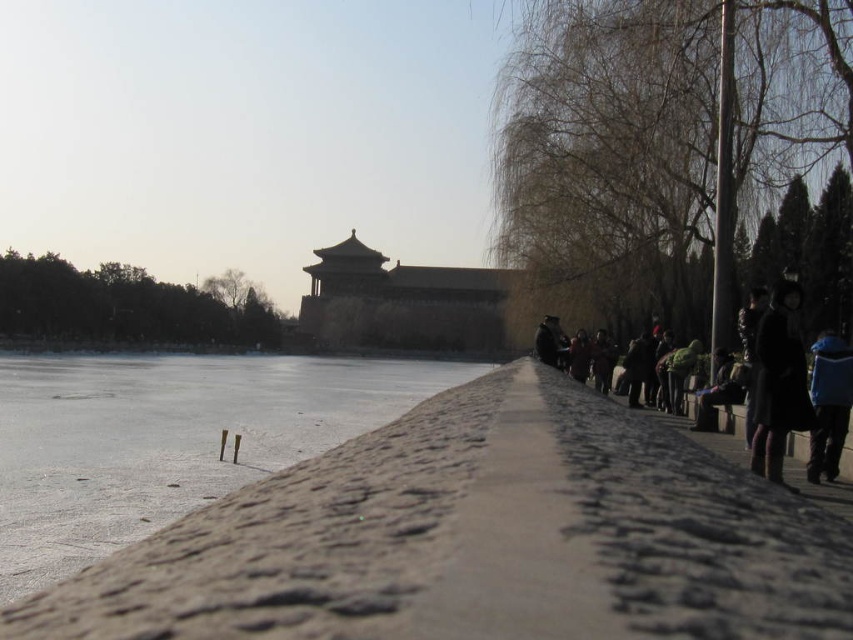
Question: Is frozen ice at lower left to the right of blue fabric jacket at right from the viewer's perspective?

Choices:
 (A) no
 (B) yes

Answer: (A)

Question: Which object appears closest to the camera in this image?

Choices:
 (A) blue fabric jacket at right
 (B) dark blue coat at right
 (C) dark wool coat at right
 (D) frozen ice at lower left

Answer: (B)

Question: Which is farther from the dark blue coat at right?

Choices:
 (A) dark wool coat at right
 (B) blue fabric jacket at right
 (C) frozen ice at lower left

Answer: (C)

Question: Does frozen ice at lower left appear over dark blue coat at right?

Choices:
 (A) yes
 (B) no

Answer: (B)

Question: Which object is the closest to the blue fabric jacket at right?

Choices:
 (A) dark wool coat at right
 (B) dark blue coat at right
 (C) frozen ice at lower left

Answer: (A)

Question: Observing the image, what is the correct spatial positioning of frozen ice at lower left in reference to blue fabric jacket at right?

Choices:
 (A) left
 (B) right

Answer: (A)